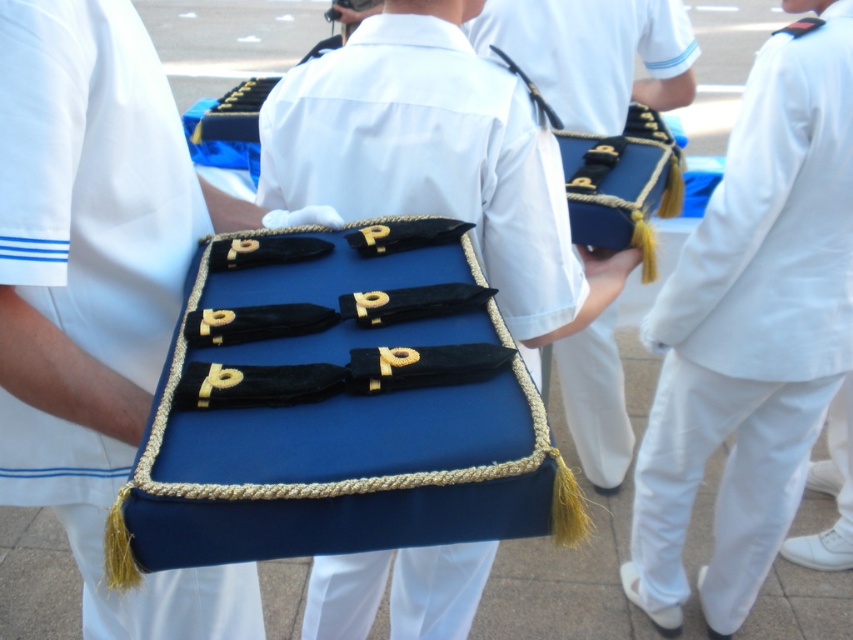
Question: Based on their relative distances, which object is nearer to the blue fabric case at center?

Choices:
 (A) blue velvet pouch at center
 (B) blue velvet case at center

Answer: (A)

Question: Where is blue velvet case at center located in relation to white cotton pants at right in the image?

Choices:
 (A) below
 (B) above

Answer: (A)

Question: Is blue velvet case at center positioned behind blue fabric case at center?

Choices:
 (A) no
 (B) yes

Answer: (A)

Question: Among these points, which one is farthest from the camera?

Choices:
 (A) (113, 269)
 (B) (344, 99)
 (C) (755, 67)

Answer: (C)

Question: Does white cotton pants at right have a smaller size compared to blue fabric case at center?

Choices:
 (A) no
 (B) yes

Answer: (A)

Question: Estimate the real-world distances between objects in this image. Which object is farther from the white cotton pants at right?

Choices:
 (A) blue velvet pouch at center
 (B) blue fabric case at center

Answer: (B)